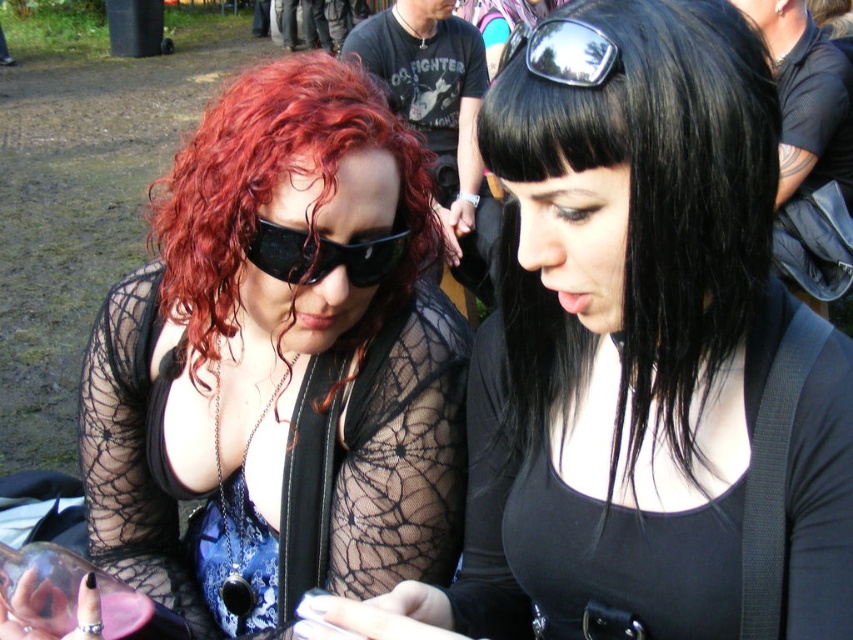
Question: Which is farther from the metallic reflective sunglasses at upper center?

Choices:
 (A) black shiny hair at center
 (B) curly red hair at left
 (C) matte black hair at center
 (D) black matte sunglasses at center

Answer: (C)

Question: Which object is the closest to the black shiny hair at center?

Choices:
 (A) matte black hair at center
 (B) metallic reflective sunglasses at upper center

Answer: (B)

Question: Which object is farther from the camera taking this photo?

Choices:
 (A) curly red hair at left
 (B) matte black hair at center
 (C) metallic reflective sunglasses at upper center

Answer: (A)

Question: Is the position of matte black hair at center less distant than that of curly red hair at left?

Choices:
 (A) no
 (B) yes

Answer: (B)

Question: Is black shiny hair at center positioned before curly red hair at left?

Choices:
 (A) no
 (B) yes

Answer: (B)

Question: Considering the relative positions of matte black hair at center and curly red hair at left in the image provided, where is matte black hair at center located with respect to curly red hair at left?

Choices:
 (A) right
 (B) left

Answer: (A)